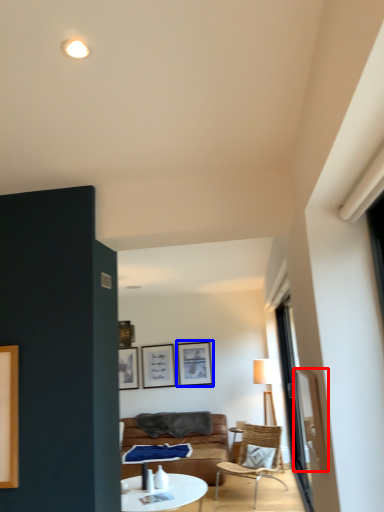
Question: Which of the following is the farthest to the observer, window screen (highlighted by a red box) or picture frame (highlighted by a blue box)?

Choices:
 (A) window screen
 (B) picture frame

Answer: (B)